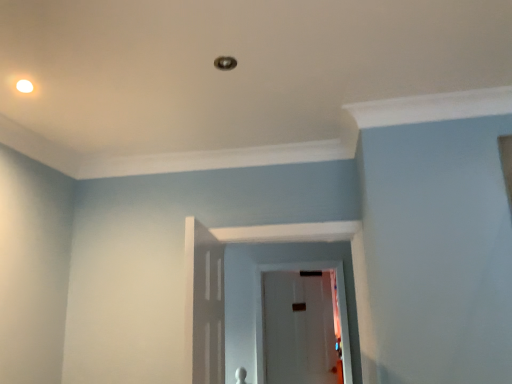
Question: In terms of size, does white glossy light fixture at upper left appear bigger or smaller than transparent glass door at center?

Choices:
 (A) small
 (B) big

Answer: (A)

Question: Do you think white glossy light fixture at upper left is within transparent glass door at center, or outside of it?

Choices:
 (A) outside
 (B) inside

Answer: (A)

Question: Based on their positions, is white glossy light fixture at upper left located to the left or right of transparent glass door at center?

Choices:
 (A) right
 (B) left

Answer: (B)

Question: Choose the correct answer: Is transparent glass door at center inside white glossy light fixture at upper left or outside it?

Choices:
 (A) inside
 (B) outside

Answer: (B)

Question: Is point (305, 269) closer or farther from the camera than point (28, 84)?

Choices:
 (A) closer
 (B) farther

Answer: (B)

Question: Considering the positions of transparent glass door at center and white glossy light fixture at upper left in the image, is transparent glass door at center bigger or smaller than white glossy light fixture at upper left?

Choices:
 (A) small
 (B) big

Answer: (B)

Question: Is transparent glass door at center to the left or to the right of white glossy light fixture at upper left in the image?

Choices:
 (A) left
 (B) right

Answer: (B)